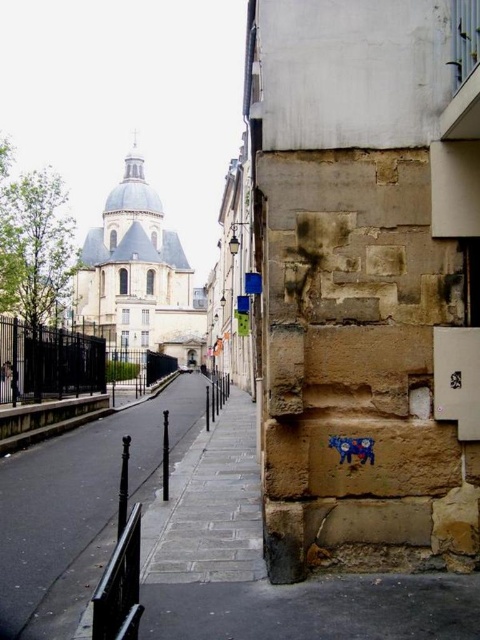
Is black asphalt pavement at center above black metal railing at lower left?

No.

Between black asphalt pavement at center and black metal railing at lower left, which one is positioned higher?

black metal railing at lower left

Where is `black asphalt pavement at center`? This screenshot has width=480, height=640. black asphalt pavement at center is located at coordinates (76, 499).